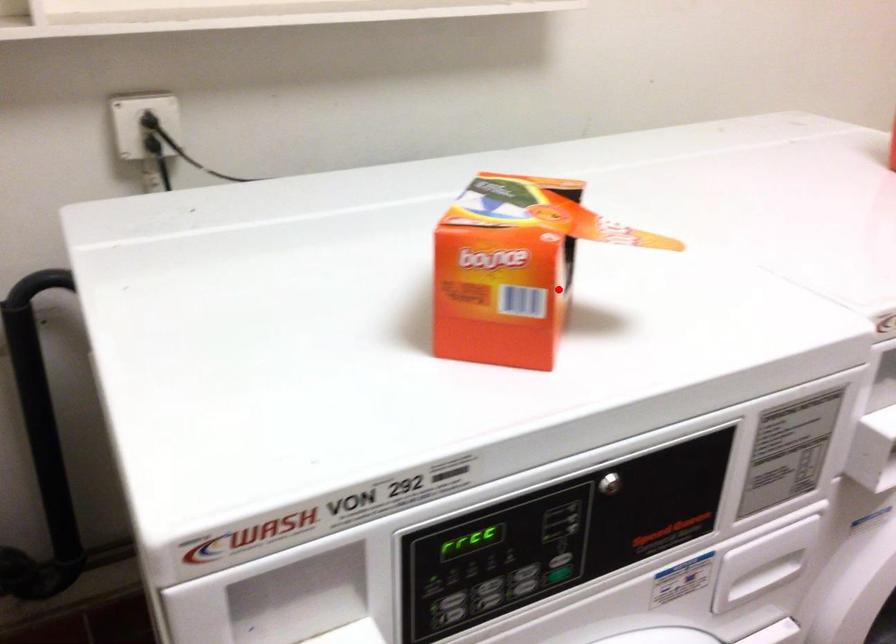
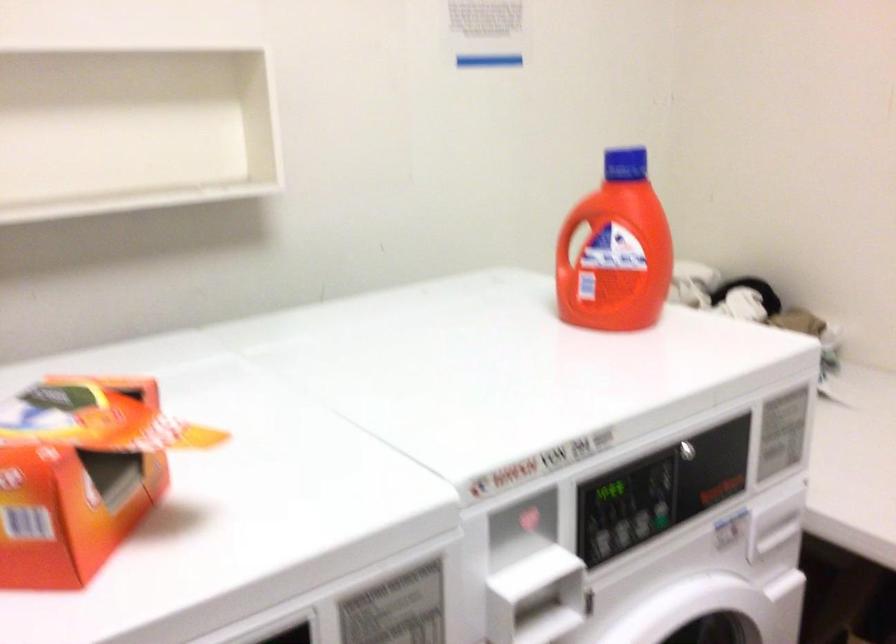
The point at the highlighted location is marked in the first image. Where is the corresponding point in the second image?

(73, 498)